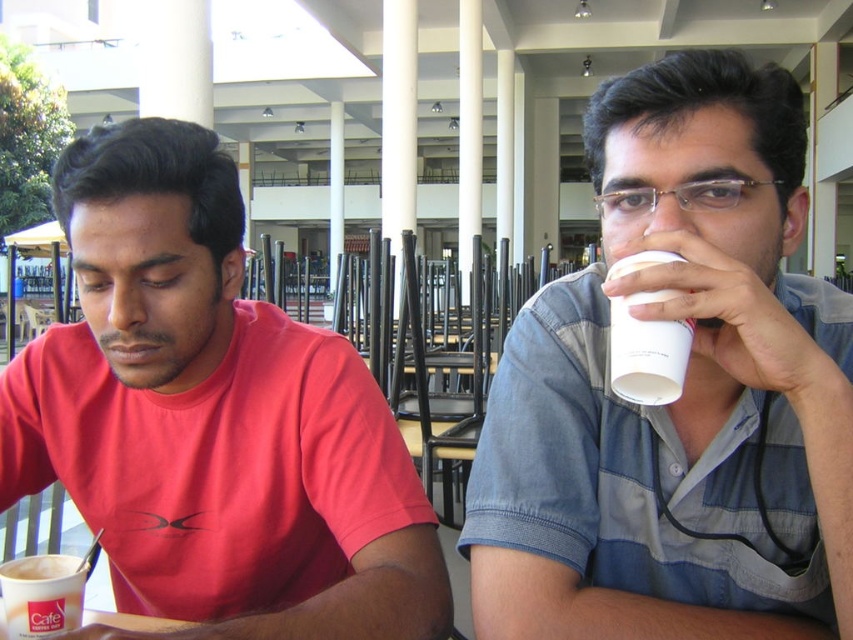
You are a barista at the outdoor cafe and need to place both the white frothy coffee cup at lower left and the white matte cup at lower left on a shelf. The shelf has a height limit of 10 cm. Which cup will not fit on the shelf?

The white frothy coffee cup at lower left is much taller than the white matte cup at lower left, so it will not fit on the shelf with a 10 cm height limit.

You are at an outdoor cafe with two people. You see a white paper cup at upper center and a matte red shirt at center. Which object is located to the right of the other?

The white paper cup at upper center is positioned on the right side of matte red shirt at center.

You are standing at the entrance of the outdoor dining area. You need to locate the matte red shirt at center. Which direction should you look to find it?

The matte red shirt at center is located at point coordinates (212, 419). To locate it, you should look towards the center of the image slightly to the right since the x coordinate is 0.655 which is more than half of the image width.